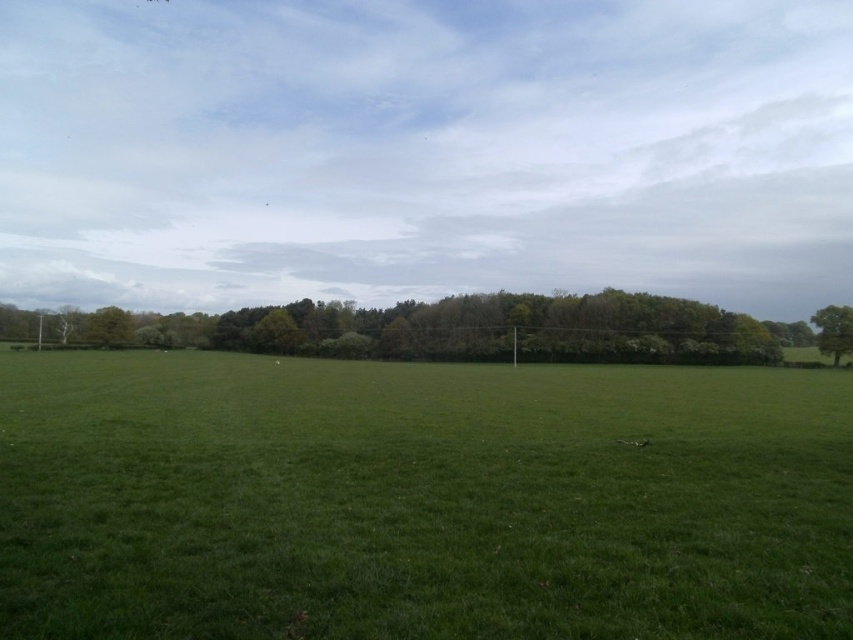
Can you confirm if green leafy trees at center is positioned below green leafy tree at right?

No, green leafy trees at center is not below green leafy tree at right.

Where is `green leafy trees at center`? This screenshot has width=853, height=640. green leafy trees at center is located at coordinates (439, 330).

Between green grass at center and green leafy trees at center, which one has more height?

green leafy trees at center

Is point (787, 600) in front of point (96, 328)?

That is True.

Is point (271, 604) positioned before point (65, 308)?

That is True.

Where is `green grass at center`? The height and width of the screenshot is (640, 853). green grass at center is located at coordinates (419, 499).

Does point (386, 561) come in front of point (836, 337)?

Yes, point (386, 561) is in front of point (836, 337).

Which of these two, green grass at center or green leafy tree at right, stands shorter?

With less height is green grass at center.

Is point (529, 525) in front of point (850, 340)?

Yes, it is.

In order to click on green grass at center in this screenshot , I will do click(x=419, y=499).